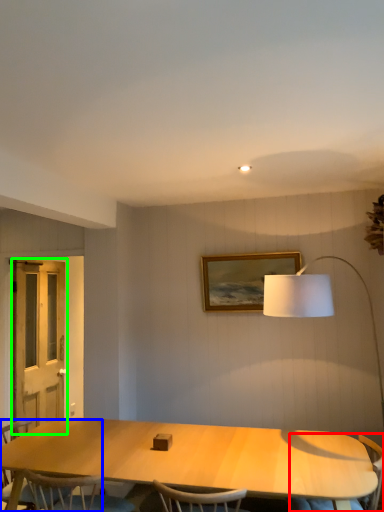
Question: Which object is positioned farthest from armchair (highlighted by a red box)? Select from chair (highlighted by a blue box) and screen door (highlighted by a green box).

Choices:
 (A) chair
 (B) screen door

Answer: (B)